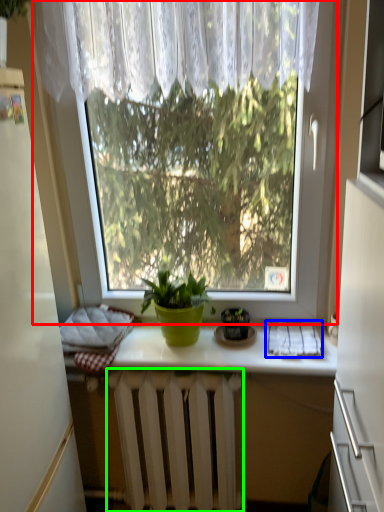
Question: Which object is the farthest from window (highlighted by a red box)? Choose among these: cloth (highlighted by a blue box) or radiator (highlighted by a green box).

Choices:
 (A) cloth
 (B) radiator

Answer: (B)